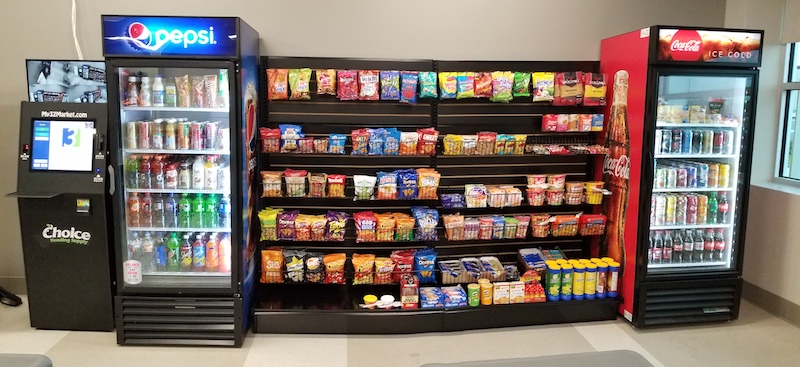
Find the location of a particular element. The height and width of the screenshot is (367, 800). non slip rug is located at coordinates (620, 360), (42, 360).